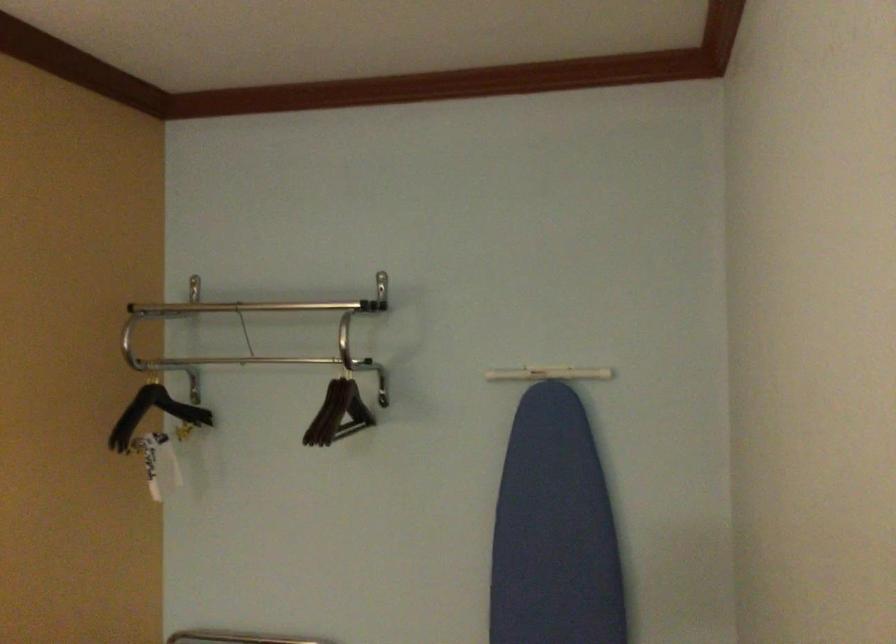
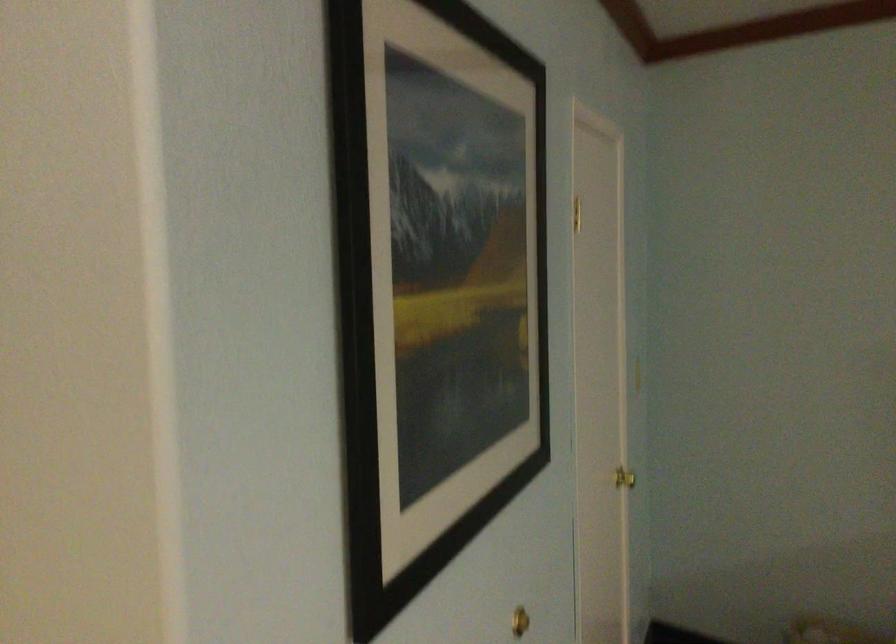
Question: Based on the continuous images, in which direction is the camera rotating? Reply with the corresponding letter.

Choices:
 (A) Left
 (B) Right
 (C) Up
 (D) Down

Answer: (B)